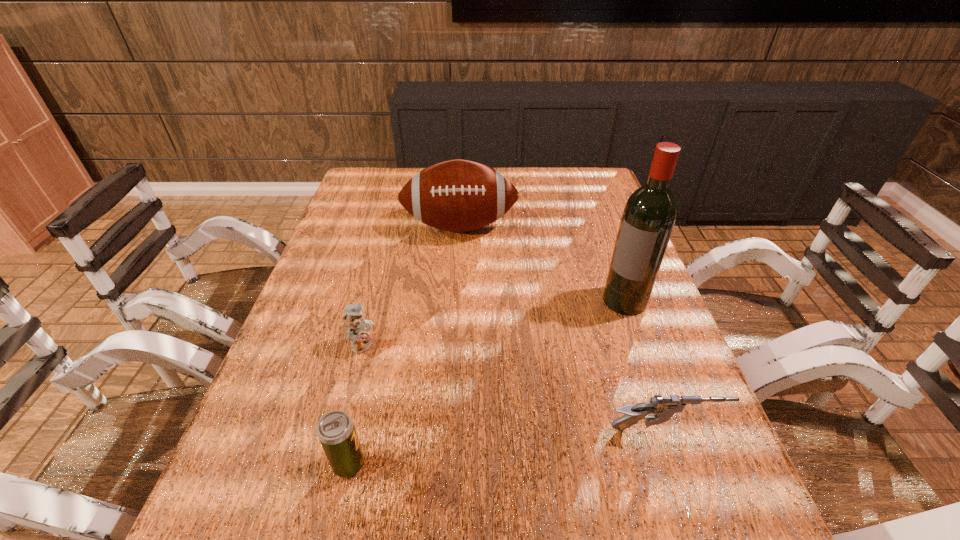
At what (x,y) coordinates should I click in order to perform the action: click on the nearest object. Please return your answer as a coordinate pair (x, y). Looking at the image, I should click on (336, 431).

Locate an element on the screen. gun is located at coordinates (663, 408).

Locate an element on the screen. This screenshot has width=960, height=540. wine bottle is located at coordinates (649, 215).

The height and width of the screenshot is (540, 960). Find the location of `the tallest object`. the tallest object is located at coordinates (649, 215).

You are a GUI agent. You are given a task and a screenshot of the screen. Output one action in this format:
    pyautogui.click(x=<x>, y=<y>)
    Task: Click on the football
    
    Given the screenshot: What is the action you would take?
    pyautogui.click(x=458, y=195)

Locate an element on the screen. The height and width of the screenshot is (540, 960). the farthest object is located at coordinates (458, 195).

You are a GUI agent. You are given a task and a screenshot of the screen. Output one action in this format:
    pyautogui.click(x=<x>, y=<y>)
    Task: Click on the teddy bear
    The height and width of the screenshot is (540, 960).
    Given the screenshot: What is the action you would take?
    (x=358, y=328)

In order to click on free space located 0.200m on the right of the beer can in this screenshot , I will do `click(475, 464)`.

In order to click on free spot located 0.120m on the label of the tallest object in this screenshot , I will do `click(591, 341)`.

This screenshot has height=540, width=960. What are the coordinates of `blank space located on the label of the tallest object` in the screenshot? It's located at (552, 390).